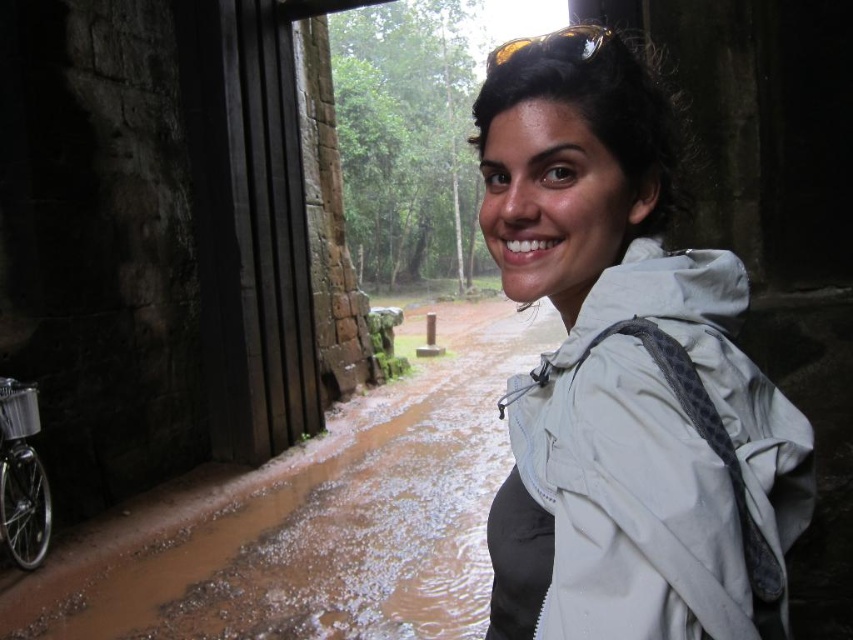
You are a hiker planning to cross the muddy pathway in the forest. You see the white matte jacket at center and the brown wet mud at lower left. Which object is taller?

The white matte jacket at center is taller than the brown wet mud at lower left.

You are a hiker planning to walk along the muddy pathway. You have a white matte jacket at center and see the brown wet mud at lower left. Which item is closer to you as you stand at the starting point of the path?

The white matte jacket at center is closer to you because it is positioned in front of the brown wet mud at lower left.